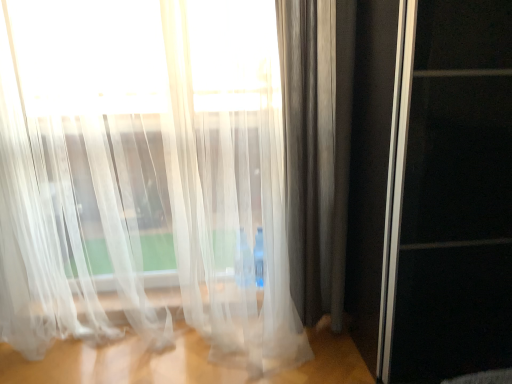
Question: Should I look upward or downward to see transparent glass screen door at right?

Choices:
 (A) up
 (B) down

Answer: (A)

Question: Are satin gray curtain at right, placed as the second curtain when sorted from left to right, and transparent glass screen door at right located far from each other?

Choices:
 (A) no
 (B) yes

Answer: (A)

Question: Can you confirm if satin gray curtain at right, placed as the second curtain when sorted from left to right, is positioned to the left of transparent glass screen door at right?

Choices:
 (A) no
 (B) yes

Answer: (B)

Question: Is satin gray curtain at right, placed as the second curtain when sorted from left to right, directly adjacent to transparent glass screen door at right?

Choices:
 (A) yes
 (B) no

Answer: (B)

Question: Is satin gray curtain at right, placed as the second curtain when sorted from left to right, outside transparent glass screen door at right?

Choices:
 (A) yes
 (B) no

Answer: (A)

Question: Is satin gray curtain at right, placed as the 1th curtain when sorted from right to left, facing towards transparent glass screen door at right?

Choices:
 (A) no
 (B) yes

Answer: (A)

Question: Can you confirm if satin gray curtain at right, placed as the 1th curtain when sorted from right to left, is smaller than transparent glass screen door at right?

Choices:
 (A) no
 (B) yes

Answer: (B)

Question: Considering the relative sizes of satin gray curtain at right, placed as the second curtain when sorted from left to right, and translucent white curtain at left, positioned as the first curtain in left-to-right order, in the image provided, is satin gray curtain at right, placed as the second curtain when sorted from left to right, taller than translucent white curtain at left, positioned as the first curtain in left-to-right order,?

Choices:
 (A) no
 (B) yes

Answer: (B)

Question: Is satin gray curtain at right, placed as the 1th curtain when sorted from right to left, bigger than translucent white curtain at left, positioned as the first curtain in left-to-right order?

Choices:
 (A) no
 (B) yes

Answer: (A)

Question: From the image's perspective, is satin gray curtain at right, placed as the second curtain when sorted from left to right, below translucent white curtain at left, positioned as the first curtain in left-to-right order?

Choices:
 (A) yes
 (B) no

Answer: (B)

Question: Is satin gray curtain at right, placed as the 1th curtain when sorted from right to left, oriented towards translucent white curtain at left, which is the 2th curtain from right to left?

Choices:
 (A) yes
 (B) no

Answer: (B)

Question: Considering the relative sizes of satin gray curtain at right, placed as the 1th curtain when sorted from right to left, and translucent white curtain at left, which is the 2th curtain from right to left, in the image provided, is satin gray curtain at right, placed as the 1th curtain when sorted from right to left, shorter than translucent white curtain at left, which is the 2th curtain from right to left,?

Choices:
 (A) no
 (B) yes

Answer: (A)

Question: Is satin gray curtain at right, placed as the 1th curtain when sorted from right to left, to the left of translucent white curtain at left, which is the 2th curtain from right to left, from the viewer's perspective?

Choices:
 (A) no
 (B) yes

Answer: (A)

Question: Does transparent glass screen door at right lie in front of satin gray curtain at right, placed as the 1th curtain when sorted from right to left?

Choices:
 (A) no
 (B) yes

Answer: (B)